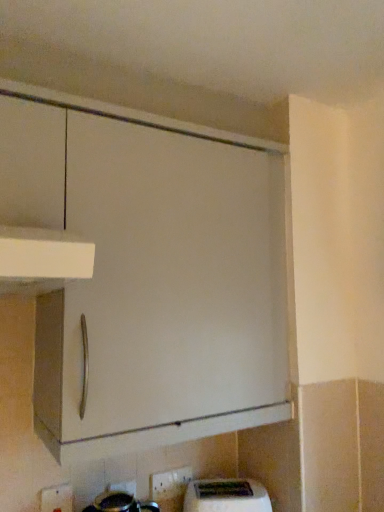
How much space does white glossy electric outlet at lower center, arranged as the 2th electric outlet when viewed from the left, occupy horizontally?

It is 0.78 inches.

Describe the element at coordinates (57, 498) in the screenshot. I see `white plastic electric outlet at lower center, the 2th electric outlet when ordered from right to left` at that location.

Measure the distance between white plastic electric outlet at lower center, arranged as the 2th electric outlet when viewed from the back, and camera.

white plastic electric outlet at lower center, arranged as the 2th electric outlet when viewed from the back, and camera are 3.77 feet apart from each other.

Locate an element on the screen. The width and height of the screenshot is (384, 512). white plastic toaster at lower center is located at coordinates (226, 496).

The image size is (384, 512). I want to click on white glossy electric outlet at lower center, which is counted as the second electric outlet, starting from the front, so click(169, 483).

From the image's perspective, is white plastic electric outlet at lower center, arranged as the first electric outlet when viewed from the front, beneath white plastic toaster at lower center?

Incorrect, from the image's perspective, white plastic electric outlet at lower center, arranged as the first electric outlet when viewed from the front, is higher than white plastic toaster at lower center.

Considering the relative sizes of white plastic electric outlet at lower center, arranged as the 2th electric outlet when viewed from the back, and white plastic toaster at lower center in the image provided, is white plastic electric outlet at lower center, arranged as the 2th electric outlet when viewed from the back, shorter than white plastic toaster at lower center?

No.

Between point (47, 508) and point (226, 493), which one is positioned in front?

The point (47, 508) is in front.

There is a white plastic toaster at lower center. Where is `the 1st electric outlet above it (from a real-world perspective)`? the 1st electric outlet above it (from a real-world perspective) is located at coordinates (57, 498).

Is white glossy electric outlet at lower center, which ranks as the 1th electric outlet in right-to-left order, in contact with white plastic toaster at lower center?

No, white glossy electric outlet at lower center, which ranks as the 1th electric outlet in right-to-left order, is not touching white plastic toaster at lower center.

In the scene shown: From the image's perspective, which one is positioned higher, white glossy electric outlet at lower center, which ranks as the 1th electric outlet in right-to-left order, or white plastic toaster at lower center?

white glossy electric outlet at lower center, which ranks as the 1th electric outlet in right-to-left order, is shown above in the image.

From the picture: Is white glossy electric outlet at lower center, which is counted as the second electric outlet, starting from the front, bigger or smaller than white plastic toaster at lower center?

white glossy electric outlet at lower center, which is counted as the second electric outlet, starting from the front, is smaller than white plastic toaster at lower center.

Is white glossy electric outlet at lower center, which ranks as the 1th electric outlet in right-to-left order, oriented towards white plastic toaster at lower center?

Yes, white glossy electric outlet at lower center, which ranks as the 1th electric outlet in right-to-left order, is turned towards white plastic toaster at lower center.

Considering the positions of points (226, 500) and (41, 501), is point (226, 500) farther from camera compared to point (41, 501)?

Yes, point (226, 500) is behind point (41, 501).

Is white plastic toaster at lower center in front of or behind white plastic electric outlet at lower center, which is the 1th electric outlet in left-to-right order, in the image?

In the image, white plastic toaster at lower center appears behind white plastic electric outlet at lower center, which is the 1th electric outlet in left-to-right order.

From the white plastic toaster at lower center, count the 2nd electric outlet to the left and point to it. Please provide its 2D coordinates.

[(57, 498)]

Can you confirm if white plastic toaster at lower center is wider than white plastic electric outlet at lower center, arranged as the first electric outlet when viewed from the front?

Yes, white plastic toaster at lower center is wider than white plastic electric outlet at lower center, arranged as the first electric outlet when viewed from the front.

Is white glossy electric outlet at lower center, arranged as the 2th electric outlet when viewed from the left, bigger than white plastic electric outlet at lower center, which is the 1th electric outlet in left-to-right order?

No, white glossy electric outlet at lower center, arranged as the 2th electric outlet when viewed from the left, is not bigger than white plastic electric outlet at lower center, which is the 1th electric outlet in left-to-right order.

Would you say white glossy electric outlet at lower center, which is counted as the second electric outlet, starting from the front, contains white plastic electric outlet at lower center, arranged as the first electric outlet when viewed from the front?

No, white plastic electric outlet at lower center, arranged as the first electric outlet when viewed from the front, is located outside of white glossy electric outlet at lower center, which is counted as the second electric outlet, starting from the front.

How different are the orientations of white glossy electric outlet at lower center, the first electric outlet positioned from the back, and white plastic electric outlet at lower center, arranged as the first electric outlet when viewed from the front, in degrees?

There is a 2.85-degree angle between the facing directions of white glossy electric outlet at lower center, the first electric outlet positioned from the back, and white plastic electric outlet at lower center, arranged as the first electric outlet when viewed from the front.

Looking at this image, from the image's perspective, relative to white plastic electric outlet at lower center, which is the 1th electric outlet in left-to-right order, is white glossy electric outlet at lower center, which ranks as the 1th electric outlet in right-to-left order, above or below?

white glossy electric outlet at lower center, which ranks as the 1th electric outlet in right-to-left order, is situated lower than white plastic electric outlet at lower center, which is the 1th electric outlet in left-to-right order, in the image.

From a real-world perspective, is white plastic electric outlet at lower center, arranged as the 2th electric outlet when viewed from the back, above or below white glossy electric outlet at lower center, the first electric outlet positioned from the back?

Clearly, from a real-world perspective, white plastic electric outlet at lower center, arranged as the 2th electric outlet when viewed from the back, is below white glossy electric outlet at lower center, the first electric outlet positioned from the back.

You are a GUI agent. You are given a task and a screenshot of the screen. Output one action in this format:
    pyautogui.click(x=<x>, y=<y>)
    Task: Click on the electric outlet behind the white plastic electric outlet at lower center, the 2th electric outlet when ordered from right to left
    The image size is (384, 512).
    Given the screenshot: What is the action you would take?
    pyautogui.click(x=169, y=483)

Looking at this image, which is more to the right, white plastic electric outlet at lower center, the 2th electric outlet when ordered from right to left, or white glossy electric outlet at lower center, arranged as the 2th electric outlet when viewed from the left?

From the viewer's perspective, white glossy electric outlet at lower center, arranged as the 2th electric outlet when viewed from the left, appears more on the right side.

Considering the relative positions of white plastic toaster at lower center and white glossy electric outlet at lower center, the first electric outlet positioned from the back, in the image provided, is white plastic toaster at lower center in front of white glossy electric outlet at lower center, the first electric outlet positioned from the back,?

Yes, white plastic toaster at lower center is in front of white glossy electric outlet at lower center, the first electric outlet positioned from the back.

From the image's perspective, is white plastic toaster at lower center under white glossy electric outlet at lower center, the first electric outlet positioned from the back?

Indeed, from the image's perspective, white plastic toaster at lower center is shown beneath white glossy electric outlet at lower center, the first electric outlet positioned from the back.

Is white plastic toaster at lower center shorter than white glossy electric outlet at lower center, which is counted as the second electric outlet, starting from the front?

No.

From a real-world perspective, is white plastic toaster at lower center located higher than white glossy electric outlet at lower center, arranged as the 2th electric outlet when viewed from the left?

Actually, white plastic toaster at lower center is physically below white glossy electric outlet at lower center, arranged as the 2th electric outlet when viewed from the left, in the real world.

Find the location of `home appliance below the white plastic electric outlet at lower center, the 2th electric outlet when ordered from right to left (from a real-world perspective)`. home appliance below the white plastic electric outlet at lower center, the 2th electric outlet when ordered from right to left (from a real-world perspective) is located at coordinates (226, 496).

Locate an element on the screen. The height and width of the screenshot is (512, 384). home appliance in front of the white glossy electric outlet at lower center, arranged as the 2th electric outlet when viewed from the left is located at coordinates (226, 496).

Based on their spatial positions, is white plastic toaster at lower center or white plastic electric outlet at lower center, arranged as the first electric outlet when viewed from the front, closer to white glossy electric outlet at lower center, which is counted as the second electric outlet, starting from the front?

white plastic toaster at lower center is positioned closer to the anchor white glossy electric outlet at lower center, which is counted as the second electric outlet, starting from the front.

Which object lies nearer to the anchor point white plastic electric outlet at lower center, arranged as the first electric outlet when viewed from the front, white plastic toaster at lower center or white glossy electric outlet at lower center, arranged as the 2th electric outlet when viewed from the left?

white glossy electric outlet at lower center, arranged as the 2th electric outlet when viewed from the left, is positioned closer to the anchor white plastic electric outlet at lower center, arranged as the first electric outlet when viewed from the front.

From the image, which object appears to be nearer to white glossy electric outlet at lower center, the first electric outlet positioned from the back, white plastic electric outlet at lower center, arranged as the first electric outlet when viewed from the front, or white plastic toaster at lower center?

The object closer to white glossy electric outlet at lower center, the first electric outlet positioned from the back, is white plastic toaster at lower center.

Consider the image. Which object lies nearer to the anchor point white plastic electric outlet at lower center, arranged as the first electric outlet when viewed from the front, white glossy electric outlet at lower center, the first electric outlet positioned from the back, or white plastic toaster at lower center?

Based on the image, white glossy electric outlet at lower center, the first electric outlet positioned from the back, appears to be nearer to white plastic electric outlet at lower center, arranged as the first electric outlet when viewed from the front.

Looking at this image, from the image, which object appears to be farther from white plastic toaster at lower center, white plastic electric outlet at lower center, the 2th electric outlet when ordered from right to left, or white glossy electric outlet at lower center, which ranks as the 1th electric outlet in right-to-left order?

Based on the image, white plastic electric outlet at lower center, the 2th electric outlet when ordered from right to left, appears to be further to white plastic toaster at lower center.

Which object lies further to the anchor point white plastic toaster at lower center, white glossy electric outlet at lower center, the first electric outlet positioned from the back, or white plastic electric outlet at lower center, arranged as the 2th electric outlet when viewed from the back?

white plastic electric outlet at lower center, arranged as the 2th electric outlet when viewed from the back, lies further to white plastic toaster at lower center than the other object.

Identify the location of electric outlet between white plastic electric outlet at lower center, arranged as the 2th electric outlet when viewed from the back, and white plastic toaster at lower center from left to right. The height and width of the screenshot is (512, 384). (169, 483).